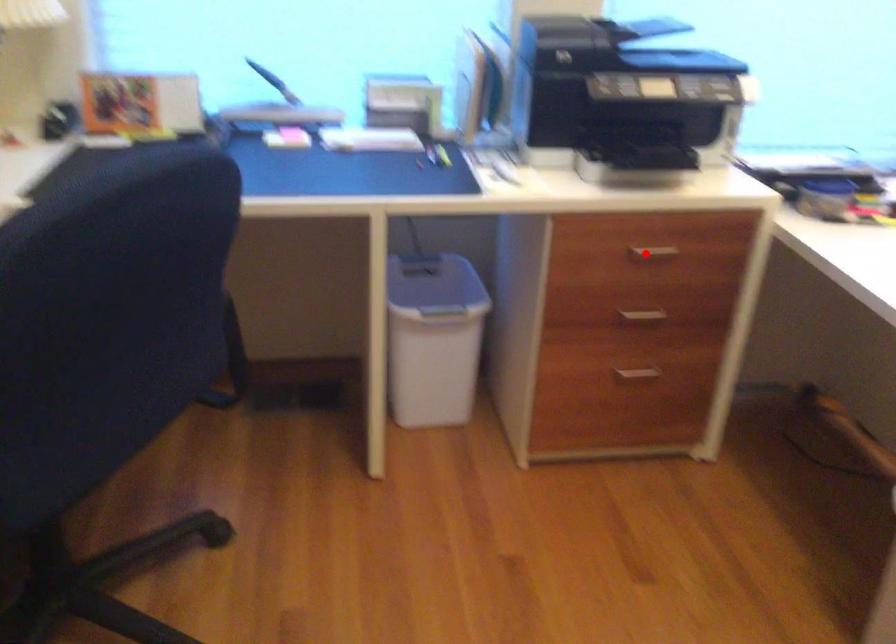
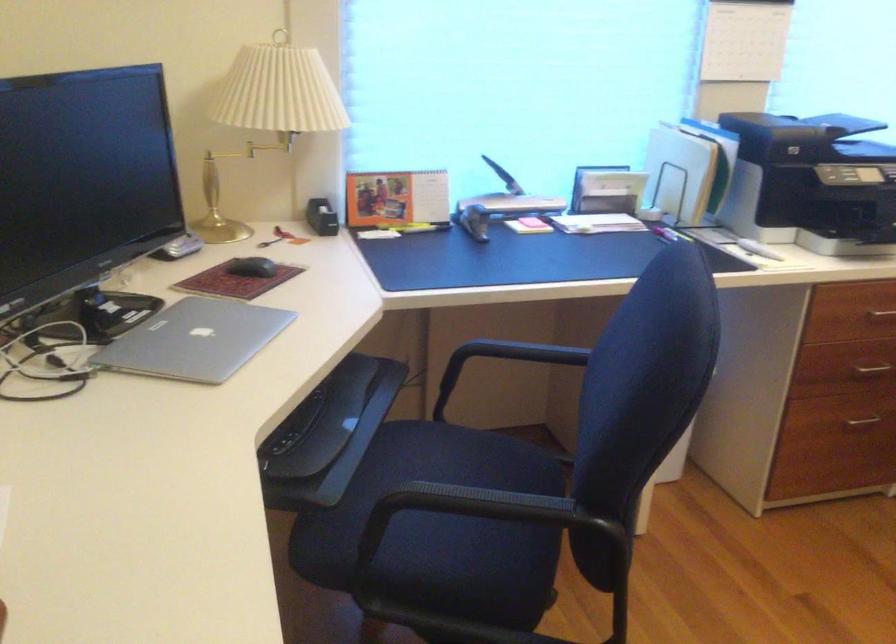
The point at the highlighted location is marked in the first image. Where is the corresponding point in the second image?

(881, 315)